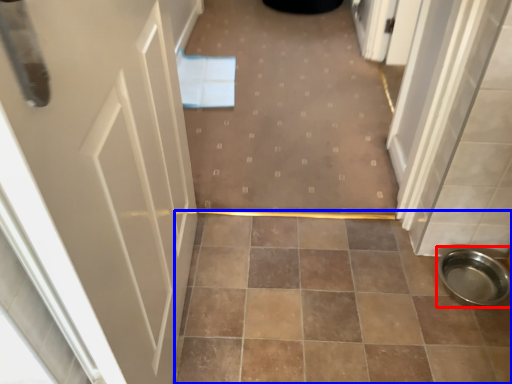
Question: Which point is closer to the camera, toilet bowl (highlighted by a red box) or ceramic tile (highlighted by a blue box)?

Choices:
 (A) toilet bowl
 (B) ceramic tile

Answer: (B)